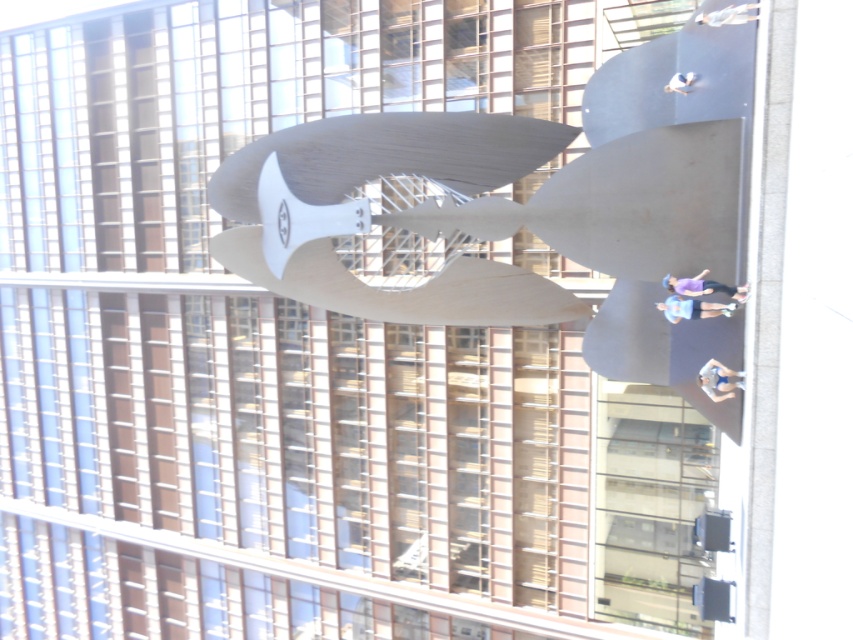
Can you confirm if light blue fabric at center is bigger than light blue fabric at upper center?

Actually, light blue fabric at center might be smaller than light blue fabric at upper center.

Does light blue fabric at center appear on the right side of light blue fabric at upper center?

Incorrect, light blue fabric at center is not on the right side of light blue fabric at upper center.

Measure the distance between light blue fabric at center and camera.

The distance of light blue fabric at center from camera is 66.30 feet.

This screenshot has width=853, height=640. Identify the location of light blue fabric at center. (692, 308).

Can you confirm if polished silver sculpture at center is wider than white matte person at center?

Yes.

Which is more to the left, polished silver sculpture at center or white matte person at center?

Positioned to the left is polished silver sculpture at center.

Between point (691, 122) and point (686, 77), which one is positioned behind?

Positioned behind is point (686, 77).

At what (x,y) coordinates should I click in order to perform the action: click on polished silver sculpture at center. Please return your answer as a coordinate pair (x, y). Looking at the image, I should click on pos(527,205).

Does point (671, 305) come in front of point (711, 387)?

That is True.

Does light blue fabric at center have a larger size compared to blue fabric shorts at lower right?

Yes.

Does point (662, 308) come in front of point (717, 364)?

No.

You are a GUI agent. You are given a task and a screenshot of the screen. Output one action in this format:
    pyautogui.click(x=<x>, y=<y>)
    Task: Click on the light blue fabric at center
    The image size is (853, 640).
    Given the screenshot: What is the action you would take?
    pyautogui.click(x=692, y=308)